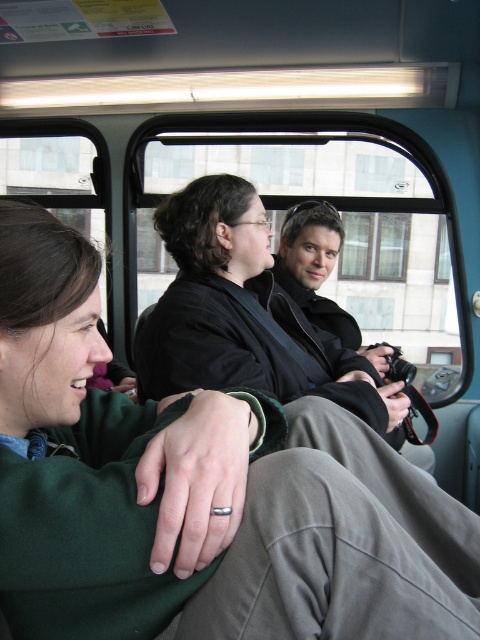
What is the exact coordinate of the green soft sweater at center in the image?

The green soft sweater at center is located at point (196, 492).

You are a photographer trying to capture a closeup of the two points in the image. You have a camera that can only focus on objects within a 0.2 unit distance from the camera. Which point, point (71, 417) or point (317, 246), is within the focus range of your camera?

Point (71, 417) is closer to the camera than point (317, 246), so it is within the focus range of the camera.